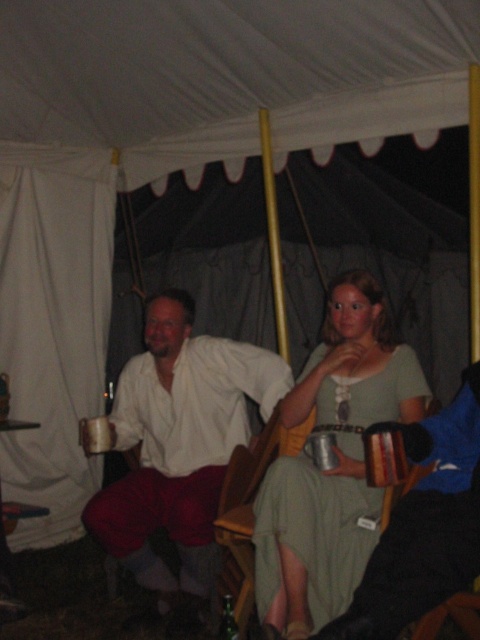
Is the position of matte green dress at center less distant than that of matte white shirt at center?

Yes, matte green dress at center is closer to the viewer.

The image size is (480, 640). I want to click on matte green dress at center, so click(x=337, y=461).

Is point (347, 326) behind point (108, 550)?

No, it is in front of (108, 550).

Where is `matte green dress at center`? This screenshot has height=640, width=480. matte green dress at center is located at coordinates (337, 461).